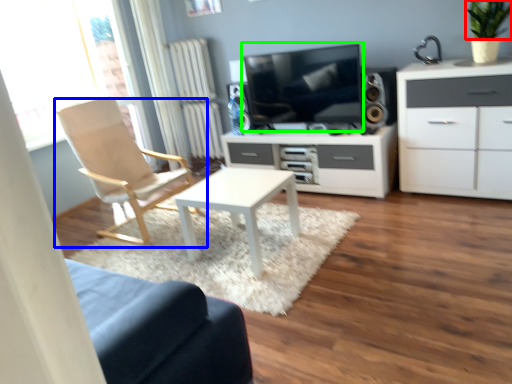
Question: Estimate the real-world distances between objects in this image. Which object is closer to plant (highlighted by a red box), chair (highlighted by a blue box) or television (highlighted by a green box)?

Choices:
 (A) chair
 (B) television

Answer: (B)